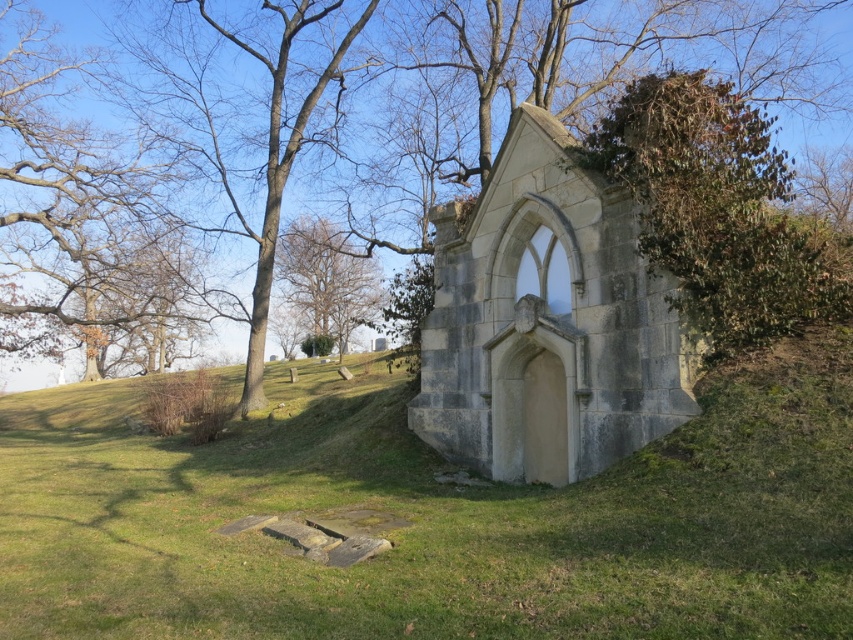
Image resolution: width=853 pixels, height=640 pixels. What do you see at coordinates (434, 518) in the screenshot?
I see `green grassy at center` at bounding box center [434, 518].

Between green grassy at center and green leafy tree at center, which one has less height?

Standing shorter between the two is green grassy at center.

Find the location of a particular element. The height and width of the screenshot is (640, 853). green grassy at center is located at coordinates (434, 518).

Is point (643, 145) farther from viewer compared to point (131, 314)?

No, it is in front of (131, 314).

Does green leafy bush at upper right have a greater width compared to brown leafy tree at upper left?

No.

Is point (656, 184) in front of point (71, 188)?

Yes, point (656, 184) is closer to viewer.

This screenshot has height=640, width=853. Identify the location of green leafy bush at upper right. pos(718,211).

Does gray stone church at center have a lesser width compared to brown bark tree at upper left?

Yes.

Which is in front, point (642, 428) or point (218, 26)?

Point (642, 428) is more forward.

You are a GUI agent. You are given a task and a screenshot of the screen. Output one action in this format:
    pyautogui.click(x=<x>, y=<y>)
    Task: Click on the gray stone church at center
    
    Given the screenshot: What is the action you would take?
    pyautogui.click(x=546, y=323)

What are the coordinates of `gray stone church at center` in the screenshot? It's located at (546, 323).